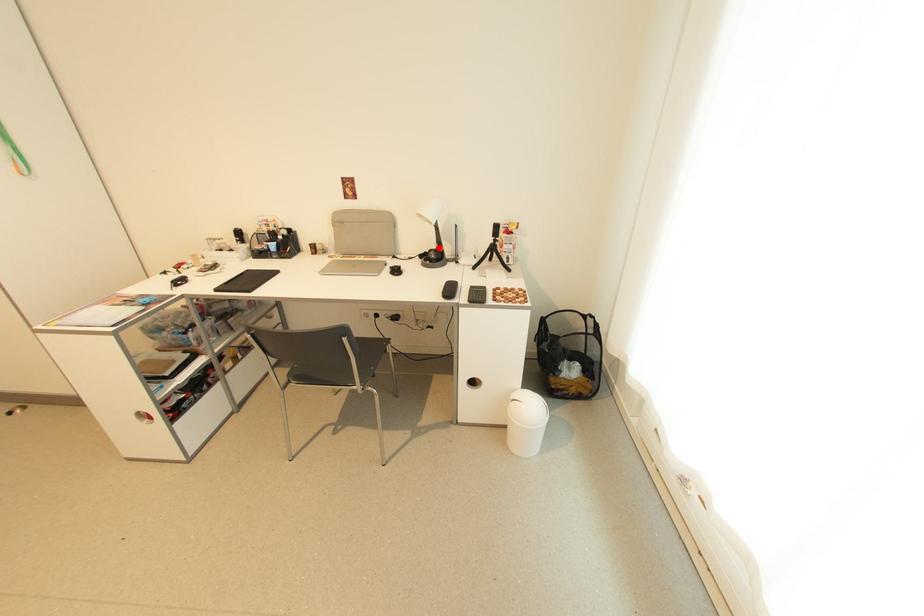
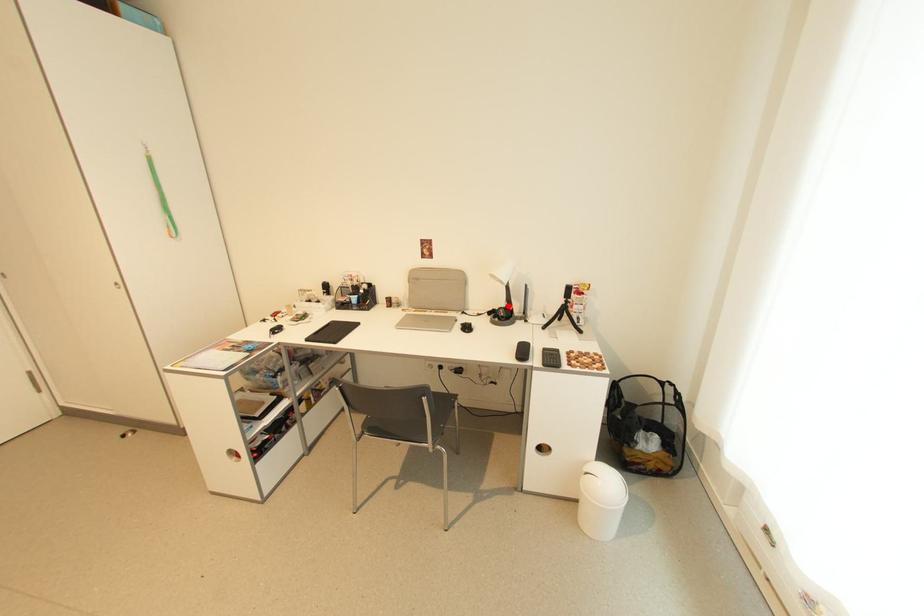
I am providing you with two images of the same scene from different viewpoints. A red point is marked on the first image and another point is marked on the second image. Does the point marked in image1 correspond to the same location as the one in image2?

Yes